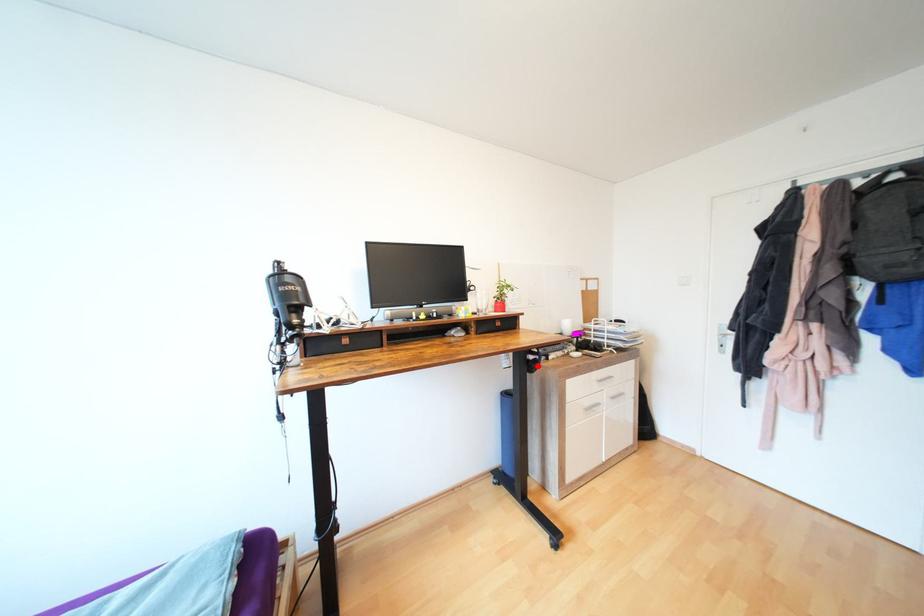
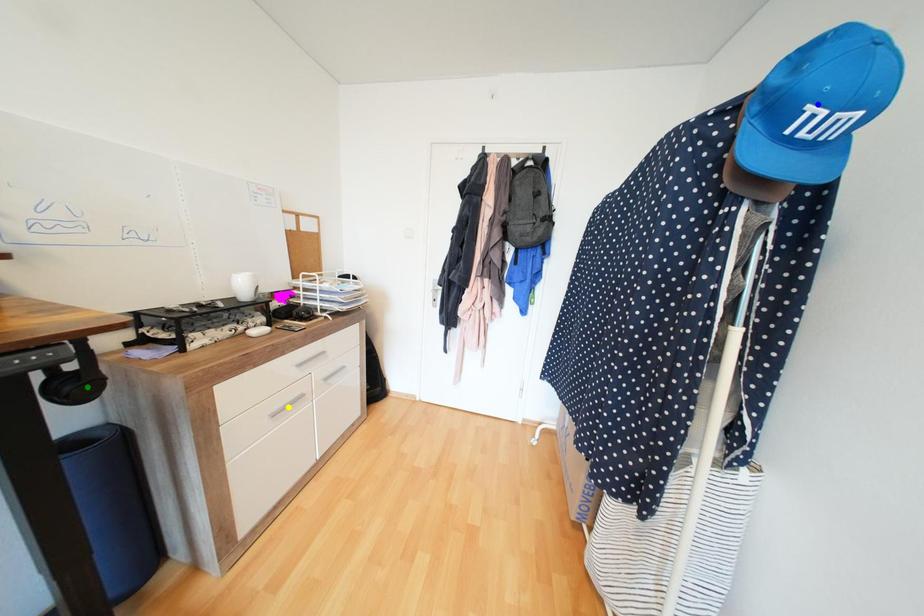
Question: I am providing you with two images of the same scene from different viewpoints. A red point is marked on the first image. You are given multiple points on the second image. Which point in image 2 is actually the same real-world point as the red point in image 1?

Choices:
 (A) yellow point
 (B) green point
 (C) blue point

Answer: (B)